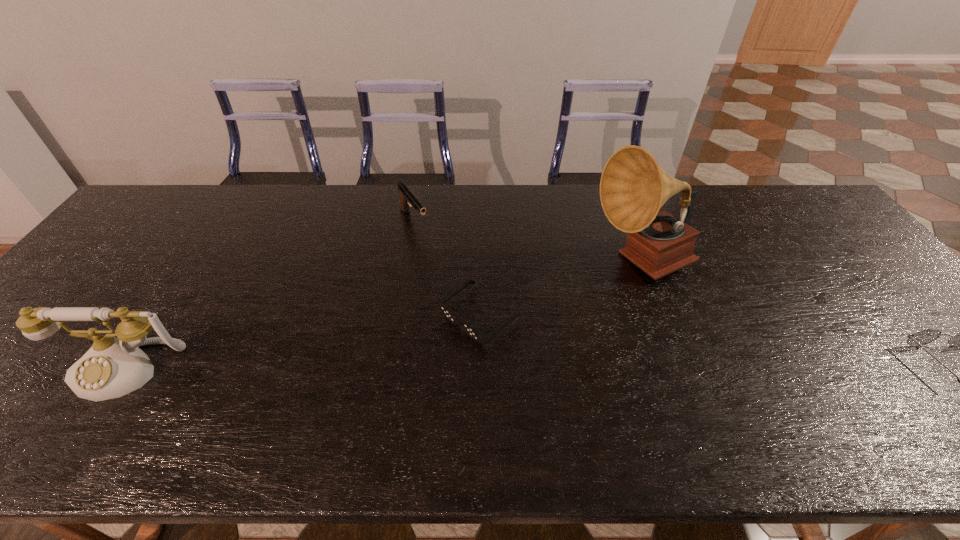
Locate an element on the screen. vacant space on the desktop that is between the fourth shortest object and the spectacles and is positioned at the muzzle of the fourth object from right to left is located at coordinates (528, 368).

At what (x,y) coordinates should I click in order to perform the action: click on free space on the desktop that is between the leftmost object and the rightmost object and is positioned on the horn of the tallest object. Please return your answer as a coordinate pair (x, y). This screenshot has width=960, height=540. Looking at the image, I should click on (571, 367).

This screenshot has height=540, width=960. I want to click on vacant space on the desktop that is between the telephone and the rightmost object and is positioned on the front-facing side of the sunglasses, so 417,368.